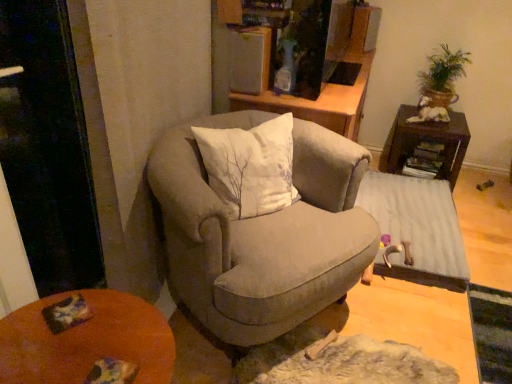
At what (x,y) coordinates should I click in order to perform the action: click on vacant area on top of orange wooden desk at lower left (from a real-world perspective). Please return your answer as a coordinate pair (x, y). Image resolution: width=512 pixels, height=384 pixels. Looking at the image, I should click on 83,332.